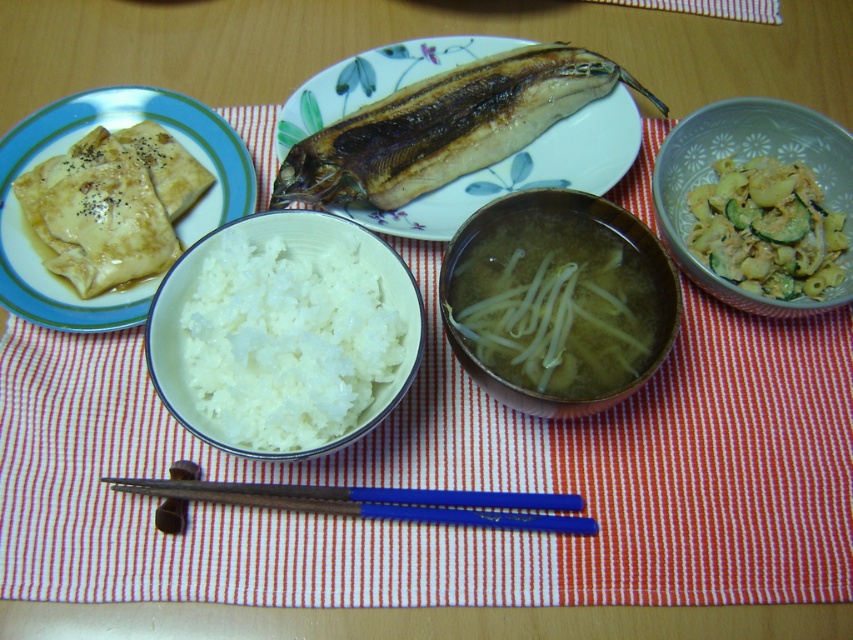
Question: Among these objects, which one is nearest to the camera?

Choices:
 (A) white matte rice at center
 (B) matte brown crepes at left

Answer: (A)

Question: Does white matte rice at center have a greater width compared to blue plastic chopsticks at center?

Choices:
 (A) no
 (B) yes

Answer: (A)

Question: Can you confirm if translucent glass bowl at center is positioned to the right of matte brown crepes at left?

Choices:
 (A) yes
 (B) no

Answer: (A)

Question: Estimate the real-world distances between objects in this image. Which object is farther from the matte brown crepes at left?

Choices:
 (A) translucent glass bowl at center
 (B) yellowish matte pasta at upper right
 (C) blue plastic chopsticks at center
 (D) grilled brown fish at center

Answer: (B)

Question: Which point is farther from the camera taking this photo?

Choices:
 (A) (x=173, y=122)
 (B) (x=529, y=280)
 (C) (x=422, y=148)

Answer: (A)

Question: Can you confirm if matte brown crepes at left is positioned below yellowish matte pasta at upper right?

Choices:
 (A) no
 (B) yes

Answer: (A)